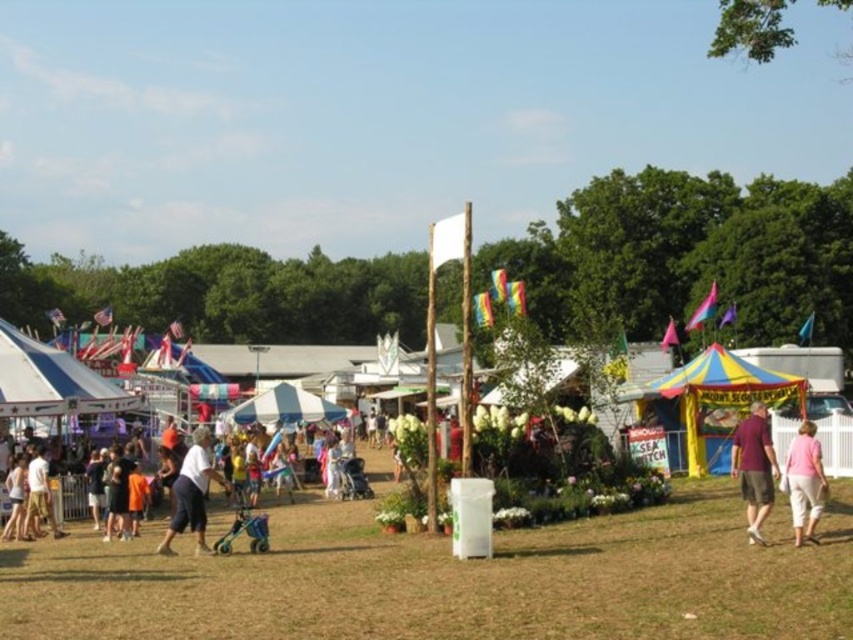
Question: Which of these objects is positioned farthest from the white fabric canopy at center?

Choices:
 (A) white fabric canopy at left
 (B) light blue cotton shirt at center
 (C) maroon fabric shirt at center-right

Answer: (C)

Question: Is maroon fabric shirt at center-right to the left of white fabric canopy at center from the viewer's perspective?

Choices:
 (A) yes
 (B) no

Answer: (B)

Question: Can you confirm if maroon fabric shirt at center-right is positioned to the left of light blue cotton shirt at center?

Choices:
 (A) yes
 (B) no

Answer: (B)

Question: Which object is farther from the camera taking this photo?

Choices:
 (A) white fabric canopy at left
 (B) maroon fabric shirt at center-right
 (C) light blue cotton shirt at center

Answer: (A)

Question: Which of the following is the closest to the observer?

Choices:
 (A) (805, 461)
 (B) (78, 412)
 (C) (294, 416)

Answer: (A)

Question: Can you confirm if light blue cotton shirt at center is positioned below white fabric canopy at center?

Choices:
 (A) yes
 (B) no

Answer: (A)